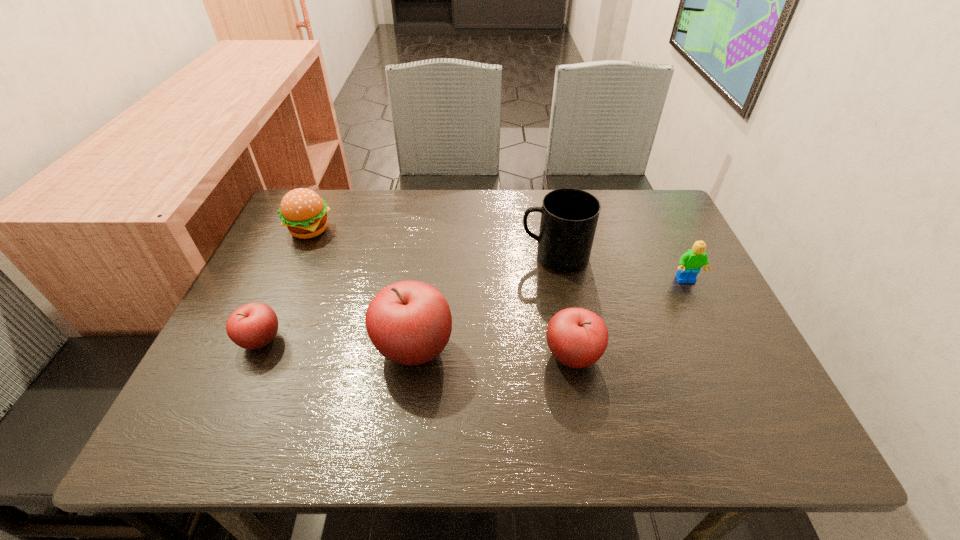
In order to click on free space located on the back of the fourth object from right to left in this screenshot , I will do `click(424, 268)`.

What are the coordinates of `blank area located on the back of the second shortest apple` in the screenshot? It's located at (563, 304).

The width and height of the screenshot is (960, 540). What are the coordinates of `vacant space located on the front of the hamburger` in the screenshot? It's located at (265, 328).

You are a GUI agent. You are given a task and a screenshot of the screen. Output one action in this format:
    pyautogui.click(x=<x>, y=<y>)
    Task: Click on the blank space located 0.290m on the side of the mug with the handle
    This screenshot has width=960, height=540.
    Given the screenshot: What is the action you would take?
    pyautogui.click(x=409, y=256)

Identify the location of blank space located 0.110m on the side of the mug with the handle. (478, 256).

The height and width of the screenshot is (540, 960). What are the coordinates of `free space located on the side of the mug with the handle` in the screenshot? It's located at (413, 256).

Image resolution: width=960 pixels, height=540 pixels. Find the location of `vacant space situated 0.200m on the face of the rightmost object`. vacant space situated 0.200m on the face of the rightmost object is located at coordinates (721, 353).

Image resolution: width=960 pixels, height=540 pixels. In order to click on hamburger that is positioned at the far edge in this screenshot , I will do `click(303, 211)`.

Identify the location of mug that is positioned at the far edge. (569, 216).

This screenshot has width=960, height=540. In order to click on apple positioned at the left edge in this screenshot , I will do `click(252, 326)`.